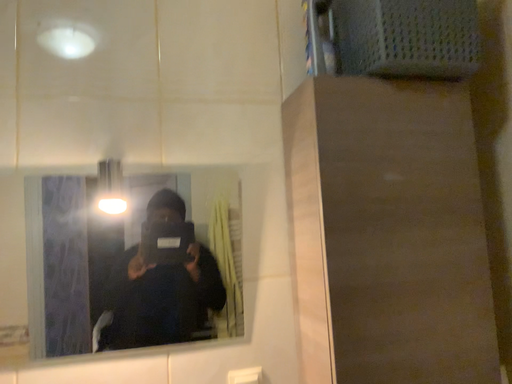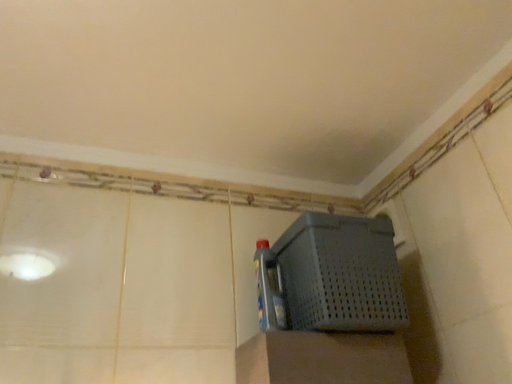
Question: How did the camera likely rotate when shooting the video?

Choices:
 (A) rotated left
 (B) rotated right

Answer: (B)